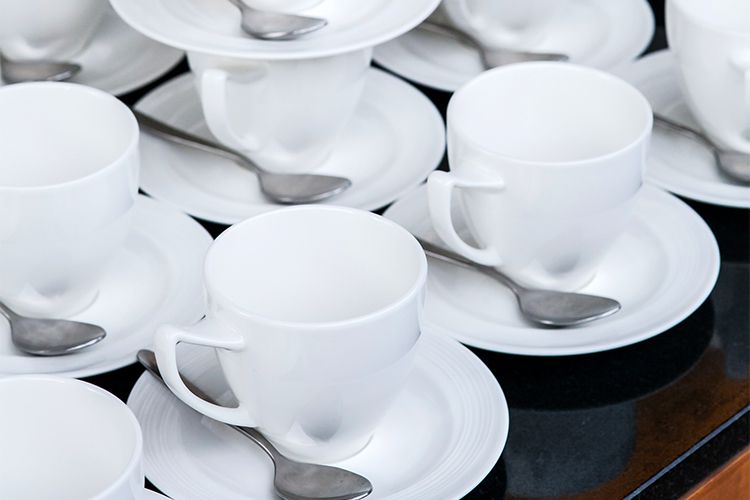
Where is `spoons`? The image size is (750, 500). spoons is located at coordinates (67, 325), (330, 482), (591, 309), (738, 154), (490, 58), (266, 22), (306, 185), (36, 56).